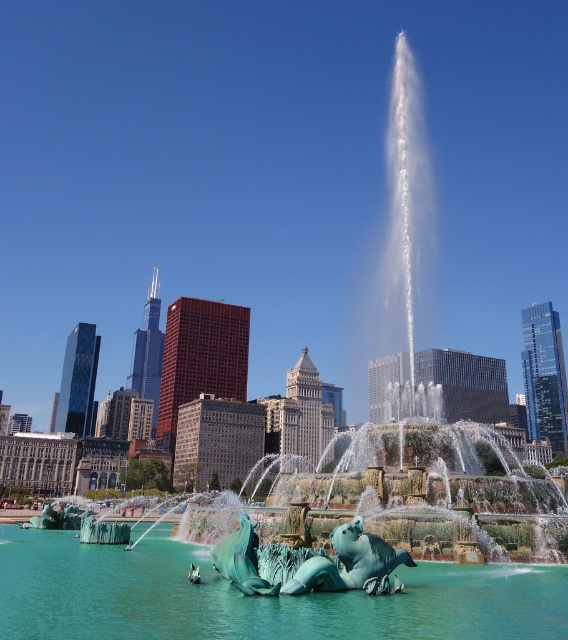
Question: Which point is closer to the camera?

Choices:
 (A) green marble sculpture at center
 (B) teal stone mermaid at lower center
 (C) teal glossy water at center

Answer: (C)

Question: Where is teal glossy water at center located in relation to teal stone mermaid at lower center in the image?

Choices:
 (A) below
 (B) above

Answer: (A)

Question: Which point is closer to the camera?

Choices:
 (A) (240, 576)
 (B) (256, 589)

Answer: (B)

Question: From the image, what is the correct spatial relationship of teal glossy water at center in relation to green marble sculpture at center?

Choices:
 (A) below
 (B) above

Answer: (A)

Question: Which point appears closest to the camera in this image?

Choices:
 (A) (256, 579)
 (B) (344, 586)
 (C) (478, 573)

Answer: (A)

Question: Is teal glossy water at center smaller than teal stone mermaid at lower center?

Choices:
 (A) yes
 (B) no

Answer: (B)